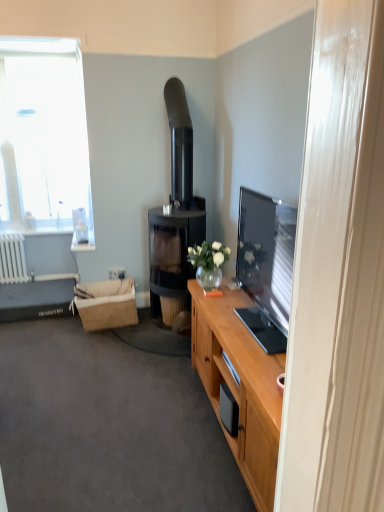
Question: From the image's perspective, is wooden cabinet at lower right positioned above or below white plastic power outlet at lower left?

Choices:
 (A) above
 (B) below

Answer: (B)

Question: From a real-world perspective, is wooden cabinet at lower right above or below white plastic power outlet at lower left?

Choices:
 (A) below
 (B) above

Answer: (A)

Question: Which is farther from the white plastic power outlet at lower left?

Choices:
 (A) black glass fireplace at center
 (B) burlap picnic basket at lower left
 (C) wooden cabinet at lower right
 (D) white glass window at upper left

Answer: (C)

Question: Which object is the farthest from the burlap picnic basket at lower left?

Choices:
 (A) black glass fireplace at center
 (B) wooden cabinet at lower right
 (C) white glass window at upper left
 (D) white plastic power outlet at lower left

Answer: (C)